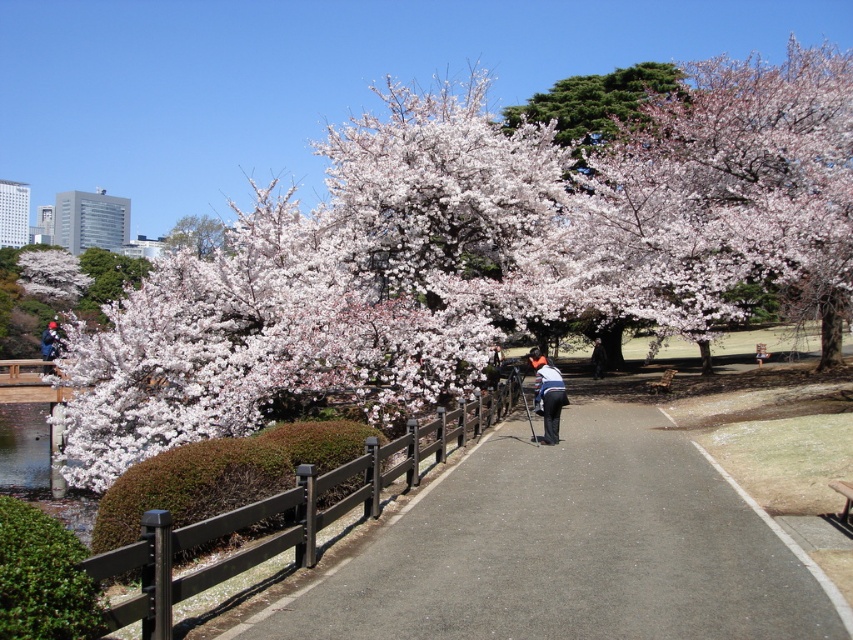
From the picture: You are standing at the point with coordinates point (524, 465) in the park scene. You want to walk towards the point with coordinates point (494, 276). Which direction should you face to walk directly towards it?

Point (494, 276) is behind point (524, 465), so you should face backwards to walk directly towards it.

You are standing on the asphalt path at center and want to reach the matte blue jacket at left. Which direction should you move to get closer to the jacket?

You should move to the left because the asphalt path at center is to the right of the matte blue jacket at left, so moving left will bring you closer to the jacket.